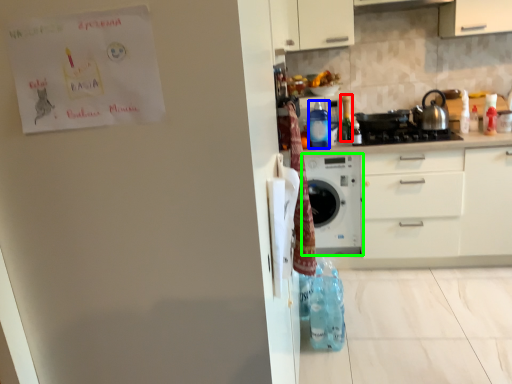
Question: Based on their relative distances, which object is nearer to bottle (highlighted by a red box)? Choose from bottle (highlighted by a blue box) and home appliance (highlighted by a green box).

Choices:
 (A) bottle
 (B) home appliance

Answer: (A)